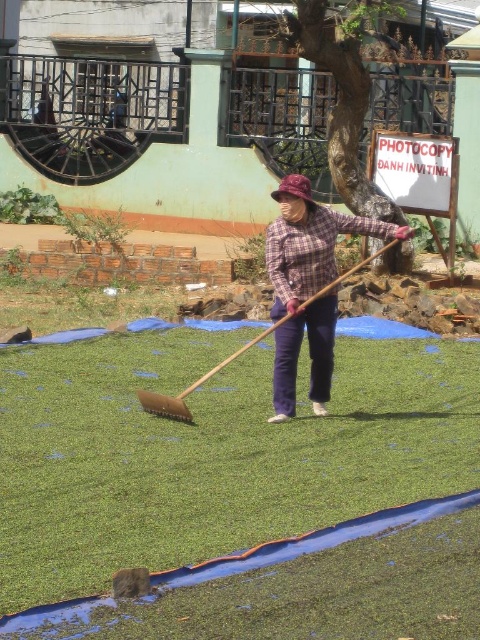
Question: Does plaid fabric shirt at center appear on the right side of wooden shovel at center?

Choices:
 (A) no
 (B) yes

Answer: (B)

Question: Can you confirm if green leafy grass at center is wider than wooden shovel at center?

Choices:
 (A) no
 (B) yes

Answer: (B)

Question: Which point appears closest to the camera in this image?

Choices:
 (A) (267, 326)
 (B) (280, 234)
 (C) (434, 400)

Answer: (B)

Question: Which of these objects is positioned closest to the wooden shovel at center?

Choices:
 (A) plaid fabric shirt at center
 (B) green leafy grass at center

Answer: (A)

Question: Which of the following is the closest to the observer?

Choices:
 (A) green leafy grass at center
 (B) wooden shovel at center
 (C) plaid fabric shirt at center

Answer: (A)

Question: Can you confirm if green leafy grass at center is thinner than wooden shovel at center?

Choices:
 (A) yes
 (B) no

Answer: (B)